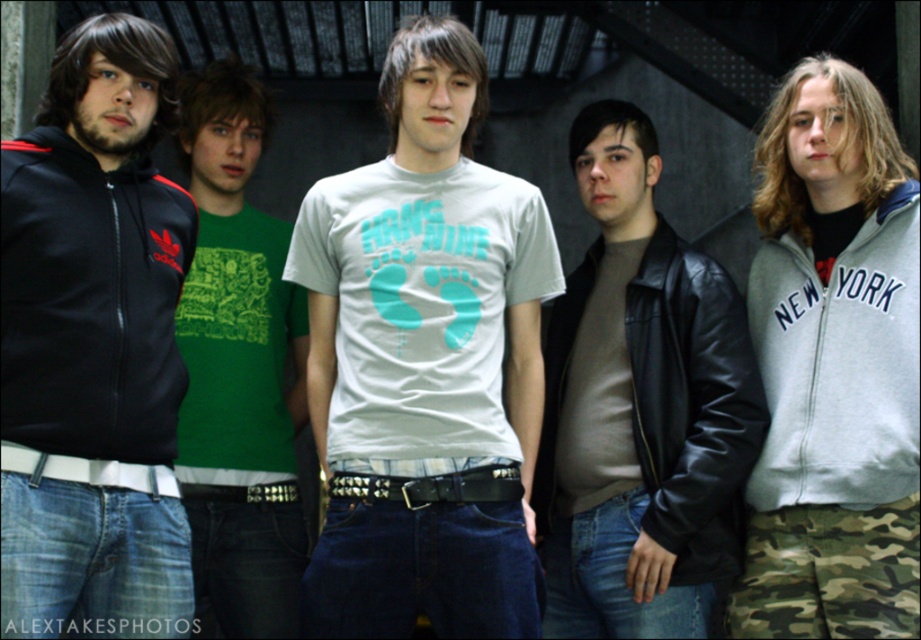
Does matte black hoodie at left appear over black leather jacket at center?

Yes.

Which is below, matte black hoodie at left or black leather jacket at center?

black leather jacket at center is lower down.

The width and height of the screenshot is (921, 640). I want to click on matte black hoodie at left, so click(x=92, y=346).

Can you confirm if white matte t-shirt at center is wider than green printed t-shirt at center?

Indeed, white matte t-shirt at center has a greater width compared to green printed t-shirt at center.

This screenshot has height=640, width=921. Describe the element at coordinates (424, 364) in the screenshot. I see `white matte t-shirt at center` at that location.

Is point (433, 401) positioned before point (219, 237)?

That is True.

Locate an element on the screen. white matte t-shirt at center is located at coordinates (424, 364).

Can you confirm if green printed t-shirt at center is positioned above gray fleece sweatshirt at upper right?

Actually, green printed t-shirt at center is below gray fleece sweatshirt at upper right.

What do you see at coordinates (239, 368) in the screenshot?
I see `green printed t-shirt at center` at bounding box center [239, 368].

This screenshot has height=640, width=921. I want to click on green printed t-shirt at center, so click(239, 368).